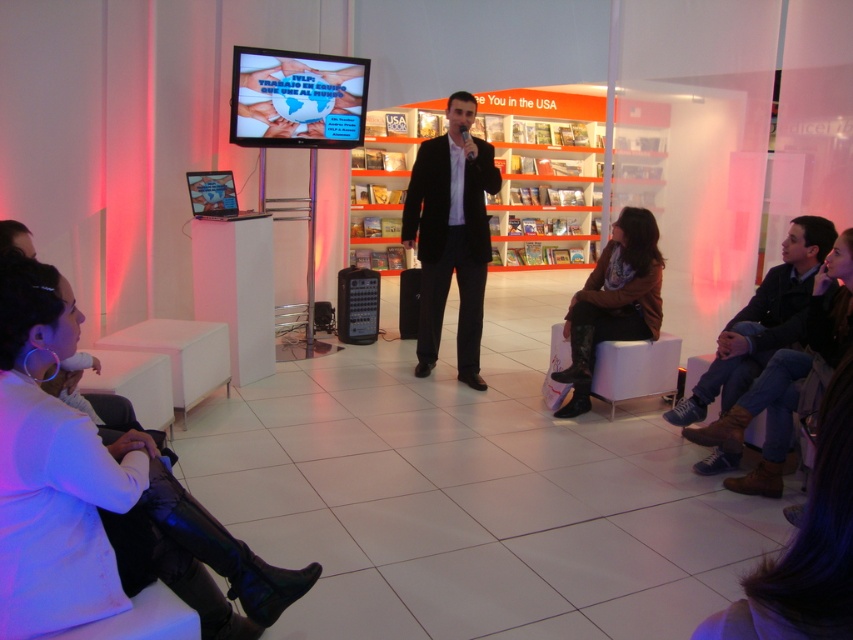
Which is behind, point (720, 461) or point (676, 353)?

The point (676, 353) is behind.

Which is in front, point (701, 380) or point (669, 374)?

Point (701, 380) is in front.

Locate an element on the screen. dark blue jeans at lower right is located at coordinates (761, 321).

Does point (631, 371) come closer to viewer compared to point (416, 294)?

That is True.

Is white fabric chair at lower center shorter than black matte speaker at center?

Indeed, white fabric chair at lower center has a lesser height compared to black matte speaker at center.

Describe the element at coordinates (635, 369) in the screenshot. I see `white fabric chair at lower center` at that location.

In order to click on white fabric chair at lower center in this screenshot , I will do `click(635, 369)`.

Can you confirm if matte black suit at center is shorter than brown leather jacket at center?

No.

Which of these two, matte black suit at center or brown leather jacket at center, stands shorter?

Standing shorter between the two is brown leather jacket at center.

Does point (447, 225) lie in front of point (602, 314)?

No.

The height and width of the screenshot is (640, 853). I want to click on matte black suit at center, so click(451, 234).